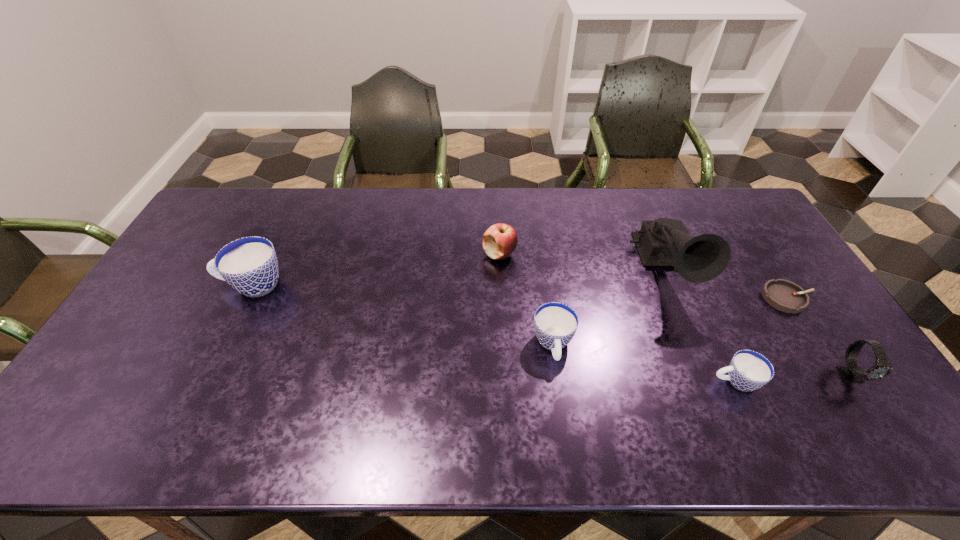
To make them evenly spaced by inserting another cup among them, please locate a free space for this new cup. Please provide its 2D coordinates. Your answer should be formatted as a tuple, i.e. [(x, y)], where the tuple contains the x and y coordinates of a point satisfying the conditions above.

[(393, 313)]